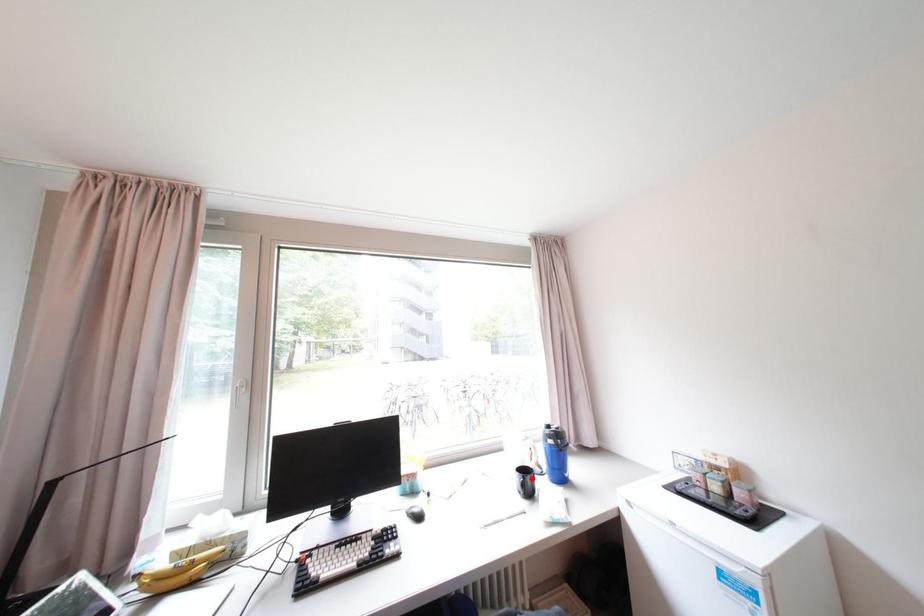
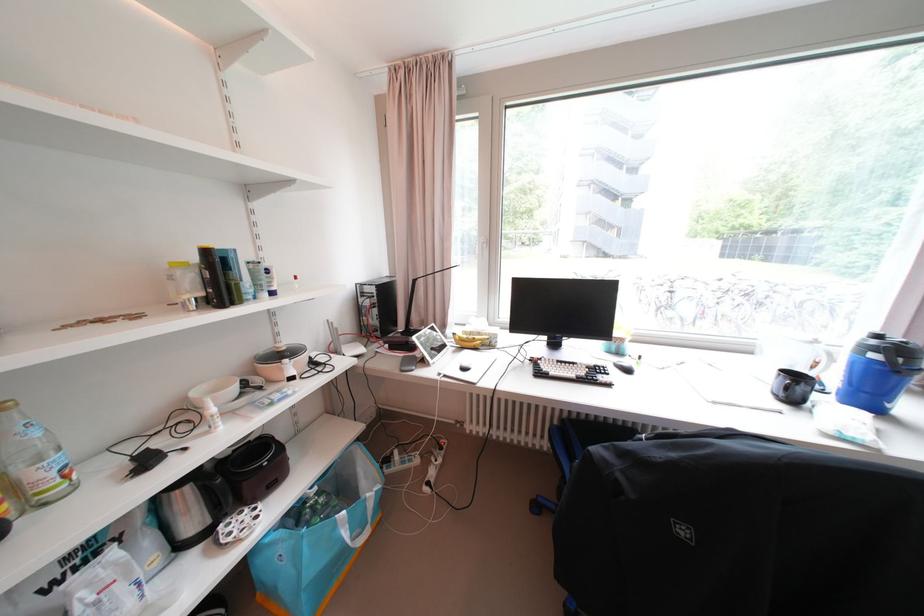
Question: A red point is marked in image1. In image2, is the corresponding 3D point closer to the camera or farther? Reply with the corresponding letter.

Choices:
 (A) The corresponding 3D point is closer.
 (B) The corresponding 3D point is farther.

Answer: (A)